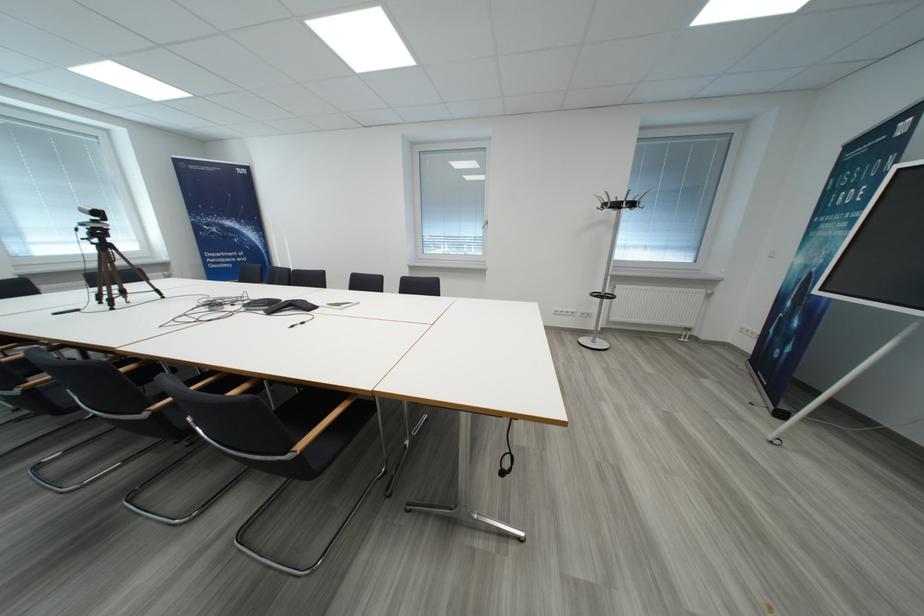
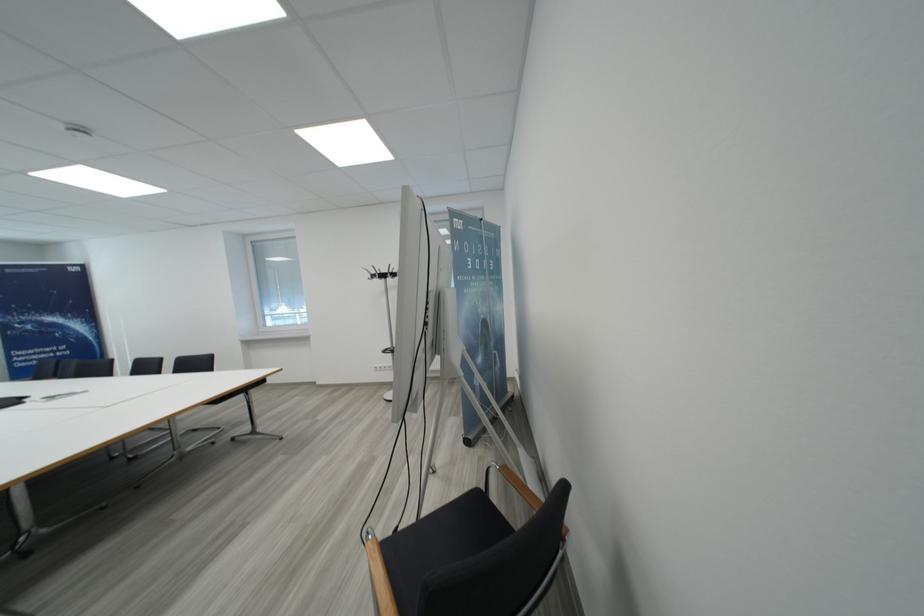
Locate, in the second image, the point that corresponds to point (639, 208) in the first image.

(390, 278)